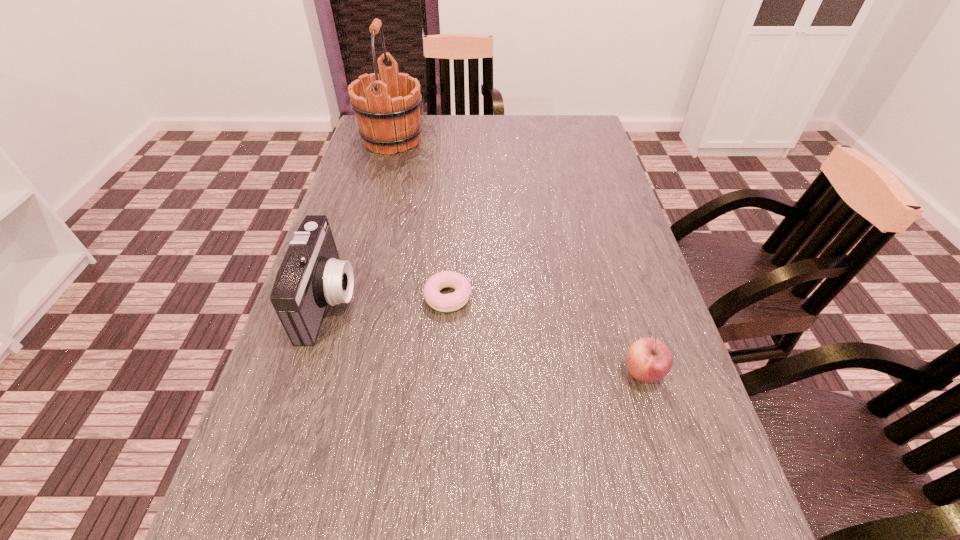
This screenshot has width=960, height=540. Find the location of `free region at the far right corner`. free region at the far right corner is located at coordinates (588, 122).

Where is `vacant area between the nearest object and the camcorder`? The image size is (960, 540). vacant area between the nearest object and the camcorder is located at coordinates (486, 336).

This screenshot has height=540, width=960. I want to click on unoccupied area between the third shortest object and the doughnut, so click(389, 299).

Identify the location of vacant area between the rightmost object and the third shortest object. The height and width of the screenshot is (540, 960). (486, 336).

The height and width of the screenshot is (540, 960). What are the coordinates of `free space that is in between the doughnut and the farthest object` in the screenshot? It's located at (420, 219).

Where is `free space between the nearest object and the camcorder`? free space between the nearest object and the camcorder is located at coordinates (486, 336).

This screenshot has height=540, width=960. In order to click on free space between the third shortest object and the doughnut in this screenshot , I will do `click(389, 299)`.

Where is `free spot between the wine bucket and the third shortest object`? Image resolution: width=960 pixels, height=540 pixels. free spot between the wine bucket and the third shortest object is located at coordinates (361, 220).

Find the location of `empty space that is in between the camcorder and the rightmost object`. empty space that is in between the camcorder and the rightmost object is located at coordinates (486, 336).

The width and height of the screenshot is (960, 540). In order to click on vacant space that's between the shortest object and the farthest object in this screenshot , I will do `click(420, 219)`.